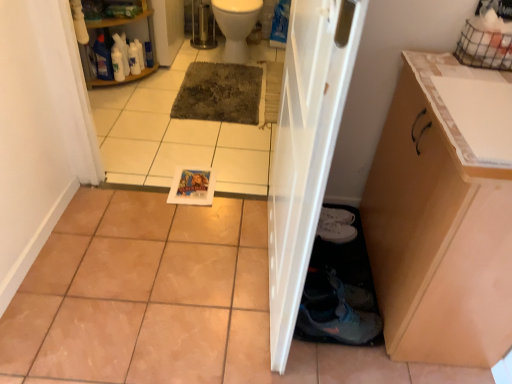
Question: From a real-world perspective, relative to gray textured mat at center, is white glossy toilet bowl at upper center vertically above or below?

Choices:
 (A) below
 (B) above

Answer: (B)

Question: Looking at their shapes, would you say white glossy toilet bowl at upper center is wider or thinner than gray textured mat at center?

Choices:
 (A) thin
 (B) wide

Answer: (A)

Question: Considering the real-world distances, which object is closest to the white tile at lower center?

Choices:
 (A) gray textured mat at center
 (B) white glossy door at center
 (C) white plastic shelf at upper left
 (D) white glossy toilet bowl at upper center

Answer: (A)

Question: Which object is positioned closest to the white glossy door at center?

Choices:
 (A) white glossy toilet bowl at upper center
 (B) white tile at lower center
 (C) white plastic shelf at upper left
 (D) gray textured mat at center

Answer: (B)